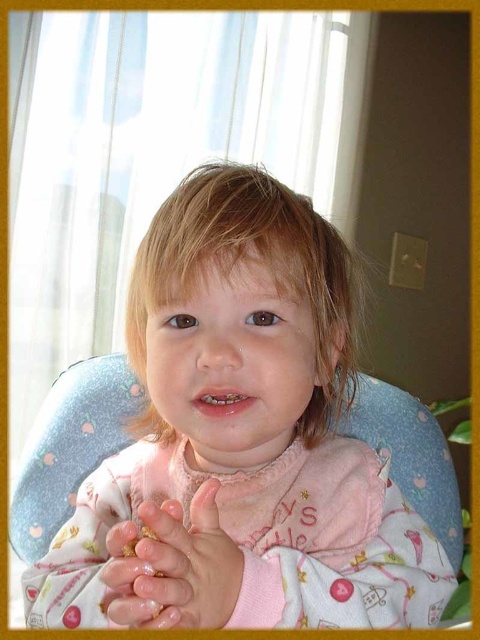
You are a photographer setting up a shot of the child in the high chair. The pink fabric bib at center is your main focus. To ensure the bib is in the center of the photo, where should you position your camera relative to the child?

The pink fabric bib at center is located at point (240, 440), so you should position the camera slightly to the right and lower down to center the bib in the frame.